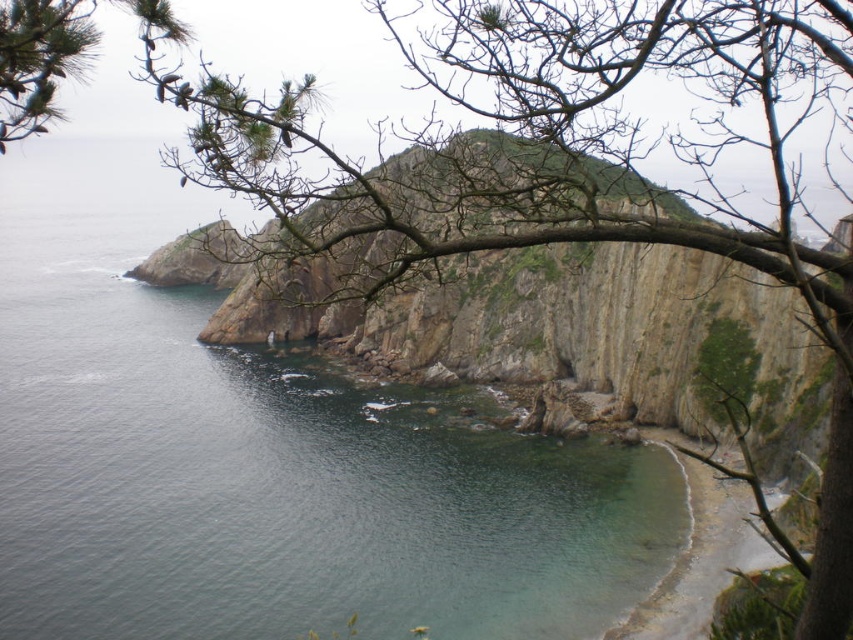
Who is lower down, clear water at center or clear sand beach at lower right?

clear sand beach at lower right is below.

The height and width of the screenshot is (640, 853). What do you see at coordinates (263, 460) in the screenshot?
I see `clear water at center` at bounding box center [263, 460].

Who is more forward, (207, 499) or (677, 595)?

Point (677, 595) is in front.

The height and width of the screenshot is (640, 853). What are the coordinates of `clear water at center` in the screenshot? It's located at (263, 460).